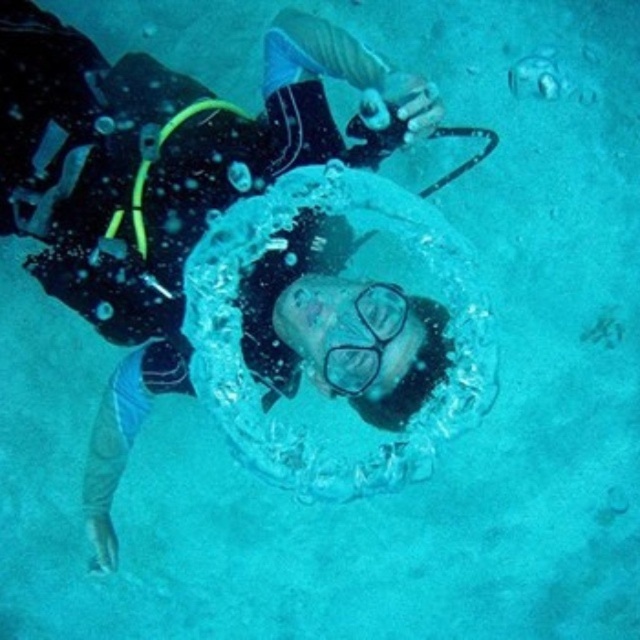
You are a marine biologist observing an underwater scene. You notice the transparent water at center and the clear plastic goggles at center. Which object has a greater width in this image?

The transparent water at center has a greater width than the clear plastic goggles at center according to the description.

You are a marine biologist planning to install a sensor on the seafloor near the scuba diver. The sensor requires a minimum distance of 5 feet from the diver to function properly. Given the coordinates provided, can you confirm if the sensor can be placed at point (346, 182) without violating the safety distance?

The distance between point (346, 182) and the viewer is 6.20 feet, which exceeds the required 5 feet minimum. Therefore, the sensor can be safely placed at point (346, 182) as it meets the safety distance requirement.